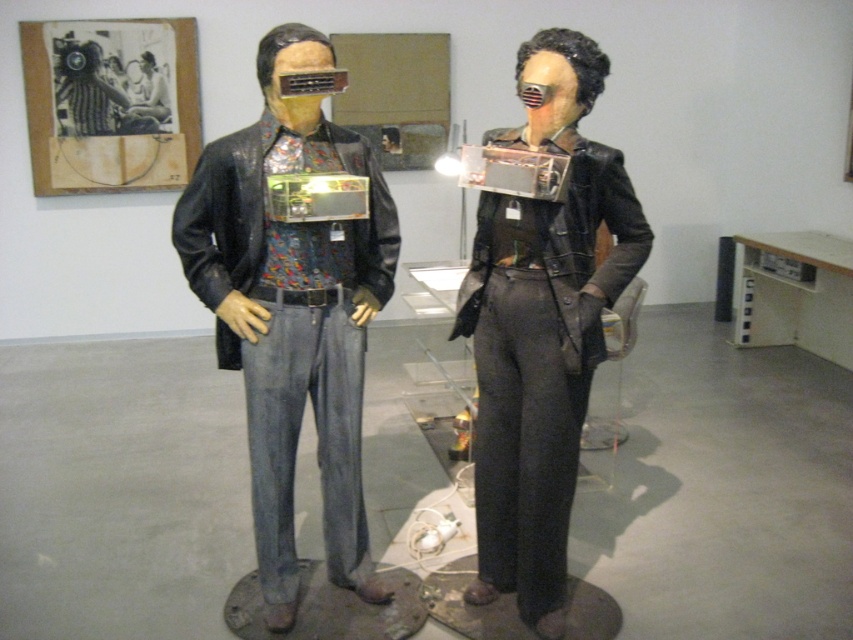
Question: Is matte black leather jacket at center smaller than shiny black leather jacket at center?

Choices:
 (A) yes
 (B) no

Answer: (B)

Question: Does matte black leather jacket at center appear over shiny black leather jacket at center?

Choices:
 (A) no
 (B) yes

Answer: (B)

Question: Which of the following is the closest to the observer?

Choices:
 (A) (288, 390)
 (B) (556, 611)

Answer: (A)

Question: Observing the image, what is the correct spatial positioning of matte black leather jacket at center in reference to shiny black leather jacket at center?

Choices:
 (A) left
 (B) right

Answer: (A)

Question: Which point appears farthest from the camera in this image?

Choices:
 (A) (543, 230)
 (B) (283, 486)

Answer: (B)